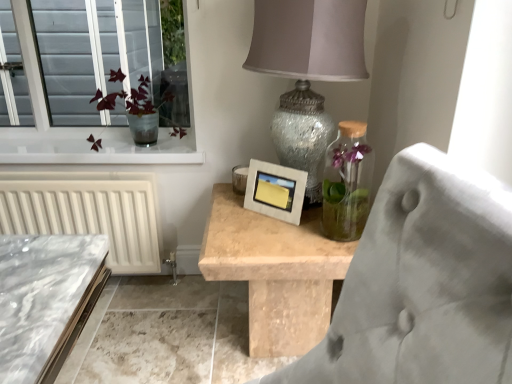
I want to click on translucent glass vase at upper left, so click(146, 99).

Is matte concrete picture frame at center closer to camera compared to translucent glass vase at upper left?

Yes, matte concrete picture frame at center is in front of translucent glass vase at upper left.

Does matte concrete picture frame at center have a lesser height compared to translucent glass vase at upper left?

Yes, matte concrete picture frame at center is shorter than translucent glass vase at upper left.

Considering the sizes of objects matte concrete picture frame at center and translucent glass vase at upper left in the image provided, who is bigger, matte concrete picture frame at center or translucent glass vase at upper left?

With larger size is translucent glass vase at upper left.

Does translucent glass vase at upper left touch speckled glass lampshade at upper center?

No, translucent glass vase at upper left is not beside speckled glass lampshade at upper center.

Does point (165, 99) lie behind point (276, 119)?

Yes, point (165, 99) is behind point (276, 119).

Is translucent glass vase at upper left not inside speckled glass lampshade at upper center?

Indeed, translucent glass vase at upper left is completely outside speckled glass lampshade at upper center.

Looking at their sizes, would you say translucent glass vase at upper left is wider or thinner than speckled glass lampshade at upper center?

Clearly, translucent glass vase at upper left has less width compared to speckled glass lampshade at upper center.

Consider the image. Is matte concrete picture frame at center far away from speckled glass lampshade at upper center?

No, matte concrete picture frame at center is not far from speckled glass lampshade at upper center.

Is matte concrete picture frame at center spatially inside speckled glass lampshade at upper center, or outside of it?

matte concrete picture frame at center can be found inside speckled glass lampshade at upper center.

How far apart are matte concrete picture frame at center and speckled glass lampshade at upper center?

matte concrete picture frame at center and speckled glass lampshade at upper center are 23.59 centimeters apart from each other.

Is matte concrete picture frame at center looking in the opposite direction of speckled glass lampshade at upper center?

That's right, matte concrete picture frame at center is facing away from speckled glass lampshade at upper center.

Between translucent glass vase at upper left and matte concrete picture frame at center, which one has more height?

translucent glass vase at upper left is taller.

From a real-world perspective, who is located lower, translucent glass vase at upper left or matte concrete picture frame at center?

matte concrete picture frame at center, from a real-world perspective.

Where is `picture frame that appears below the translucent glass vase at upper left (from a real-world perspective)`? picture frame that appears below the translucent glass vase at upper left (from a real-world perspective) is located at coordinates coord(275,191).

Considering the points (106, 98) and (264, 202), which point is in front, point (106, 98) or point (264, 202)?

The point (264, 202) is in front.

Is speckled glass lampshade at upper center positioned before translucent glass vase at upper left?

Yes, it is in front of translucent glass vase at upper left.

Considering the sizes of objects speckled glass lampshade at upper center and translucent glass vase at upper left in the image provided, who is taller, speckled glass lampshade at upper center or translucent glass vase at upper left?

Standing taller between the two is speckled glass lampshade at upper center.

How distant is speckled glass lampshade at upper center from translucent glass vase at upper left?

speckled glass lampshade at upper center is 27.29 inches from translucent glass vase at upper left.

Does point (360, 9) come in front of point (96, 97)?

That is True.

Could you tell me if speckled glass lampshade at upper center is turned towards matte concrete picture frame at center?

Yes, speckled glass lampshade at upper center is turned towards matte concrete picture frame at center.

Can you confirm if speckled glass lampshade at upper center is positioned to the left of matte concrete picture frame at center?

In fact, speckled glass lampshade at upper center is to the right of matte concrete picture frame at center.

Can you tell me how much speckled glass lampshade at upper center and matte concrete picture frame at center differ in facing direction?

The facing directions of speckled glass lampshade at upper center and matte concrete picture frame at center are 36 degrees apart.

From a real-world perspective, is speckled glass lampshade at upper center below matte concrete picture frame at center?

No.

Where is `floral arrangement that is on the left side of matte concrete picture frame at center`? The height and width of the screenshot is (384, 512). floral arrangement that is on the left side of matte concrete picture frame at center is located at coordinates (146, 99).

Locate an element on the screen. floral arrangement lying behind the speckled glass lampshade at upper center is located at coordinates (146, 99).

Based on their spatial positions, is matte concrete picture frame at center or speckled glass lampshade at upper center further from translucent glass vase at upper left?

Based on the image, speckled glass lampshade at upper center appears to be further to translucent glass vase at upper left.

Based on their spatial positions, is translucent glass vase at upper left or matte concrete picture frame at center further from speckled glass lampshade at upper center?

translucent glass vase at upper left is further to speckled glass lampshade at upper center.

When comparing their distances from translucent glass vase at upper left, does speckled glass lampshade at upper center or matte concrete picture frame at center seem further?

speckled glass lampshade at upper center lies further to translucent glass vase at upper left than the other object.

Estimate the real-world distances between objects in this image. Which object is further from speckled glass lampshade at upper center, matte concrete picture frame at center or translucent glass vase at upper left?

Based on the image, translucent glass vase at upper left appears to be further to speckled glass lampshade at upper center.

Which object lies further to the anchor point matte concrete picture frame at center, translucent glass vase at upper left or speckled glass lampshade at upper center?

translucent glass vase at upper left.

When comparing their distances from matte concrete picture frame at center, does speckled glass lampshade at upper center or translucent glass vase at upper left seem further?

Based on the image, translucent glass vase at upper left appears to be further to matte concrete picture frame at center.

At what (x,y) coordinates should I click in order to perform the action: click on picture frame located between translucent glass vase at upper left and speckled glass lampshade at upper center in the left-right direction. Please return your answer as a coordinate pair (x, y). Image resolution: width=512 pixels, height=384 pixels. Looking at the image, I should click on (275, 191).